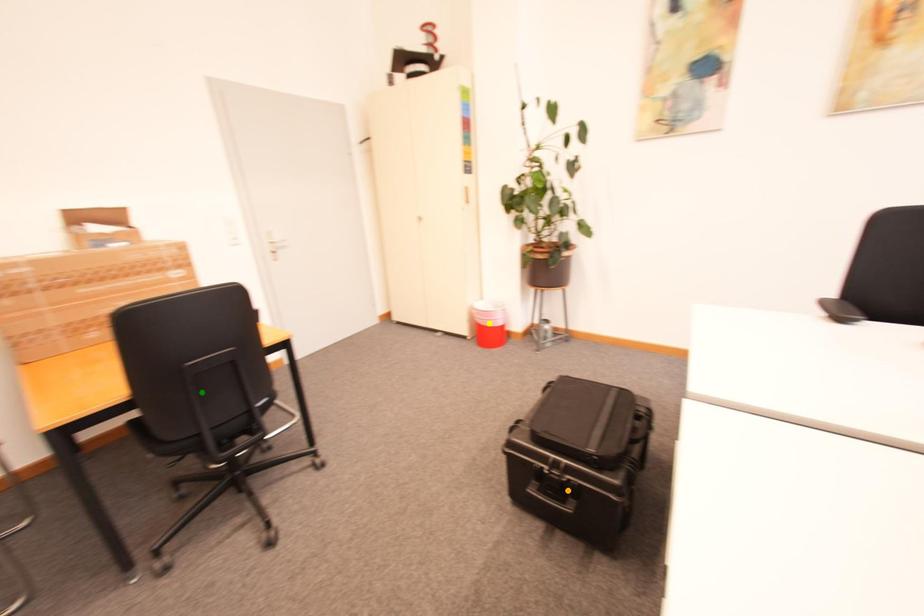
Order these from farthest to nearest:
yellow point, green point, orange point

1. yellow point
2. green point
3. orange point